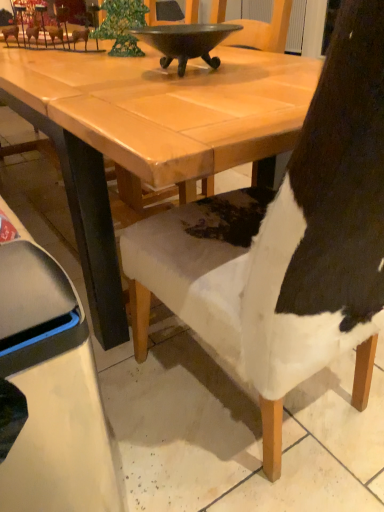
Where is `vacant space that is to the left of shiny dark metal bowl at upper center`? Image resolution: width=384 pixels, height=512 pixels. vacant space that is to the left of shiny dark metal bowl at upper center is located at coordinates (88, 75).